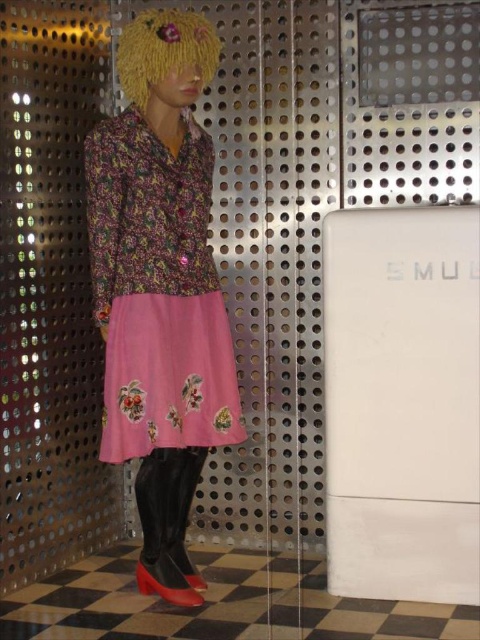
Consider the image. Who is higher up, shiny black leather boots at lower center or shiny red leather shoe at lower center?

Positioned higher is shiny black leather boots at lower center.

Does shiny black leather boots at lower center have a lesser width compared to shiny red leather shoe at lower center?

In fact, shiny black leather boots at lower center might be wider than shiny red leather shoe at lower center.

Does point (141, 554) come closer to viewer compared to point (182, 600)?

No.

Where is `shiny black leather boots at lower center`? shiny black leather boots at lower center is located at coordinates click(x=168, y=524).

Does floral-patterned fabric dress at center have a greater height compared to matte black shoe at lower left?

Yes, floral-patterned fabric dress at center is taller than matte black shoe at lower left.

Which is in front, point (154, 26) or point (180, 560)?

Point (154, 26) is in front.

At what (x,y) coordinates should I click in order to perform the action: click on floral-patterned fabric dress at center. Please return your answer as a coordinate pair (x, y). The width and height of the screenshot is (480, 640). Looking at the image, I should click on (159, 273).

Does floral-patterned fabric dress at center have a greater height compared to shiny red leather shoe at lower center?

Yes, floral-patterned fabric dress at center is taller than shiny red leather shoe at lower center.

Between floral-patterned fabric dress at center and shiny red leather shoe at lower center, which one appears on the left side from the viewer's perspective?

Positioned to the left is floral-patterned fabric dress at center.

The height and width of the screenshot is (640, 480). In order to click on floral-patterned fabric dress at center in this screenshot , I will do `click(159, 273)`.

Where is `floral-patterned fabric dress at center`? floral-patterned fabric dress at center is located at coordinates (159, 273).